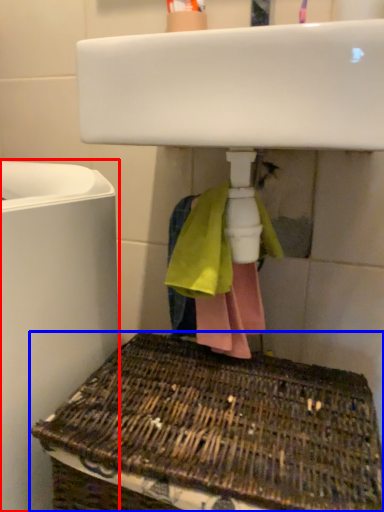
Question: Which object appears farthest to the camera in this image, appliance (highlighted by a red box) or basket (highlighted by a blue box)?

Choices:
 (A) appliance
 (B) basket

Answer: (A)